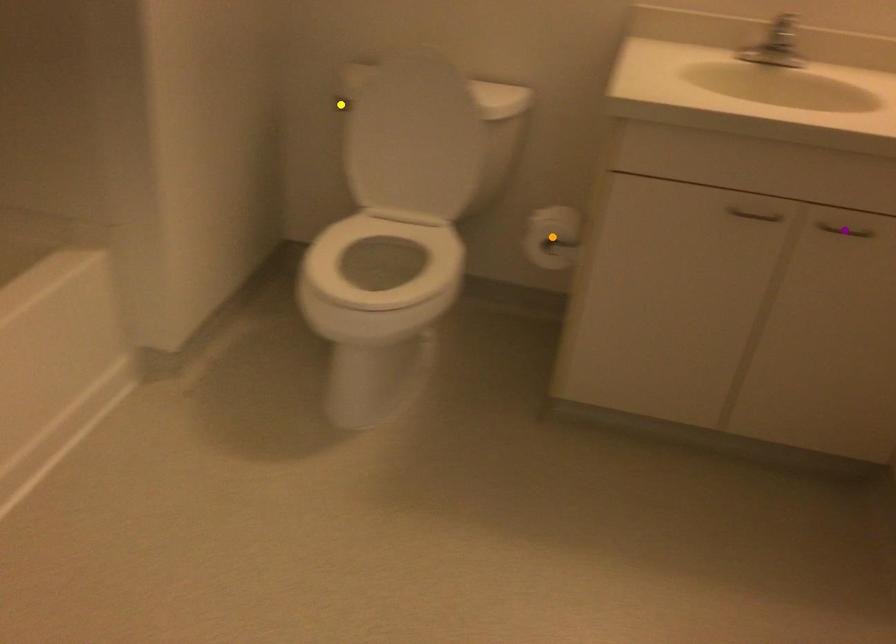
Order these from nearest to farthest:
yellow point, purple point, orange point

purple point < orange point < yellow point